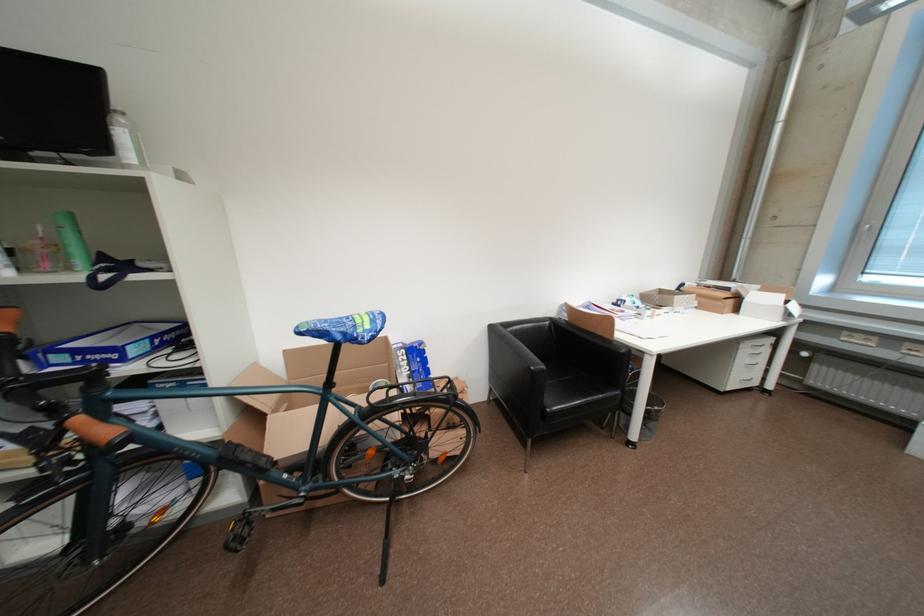
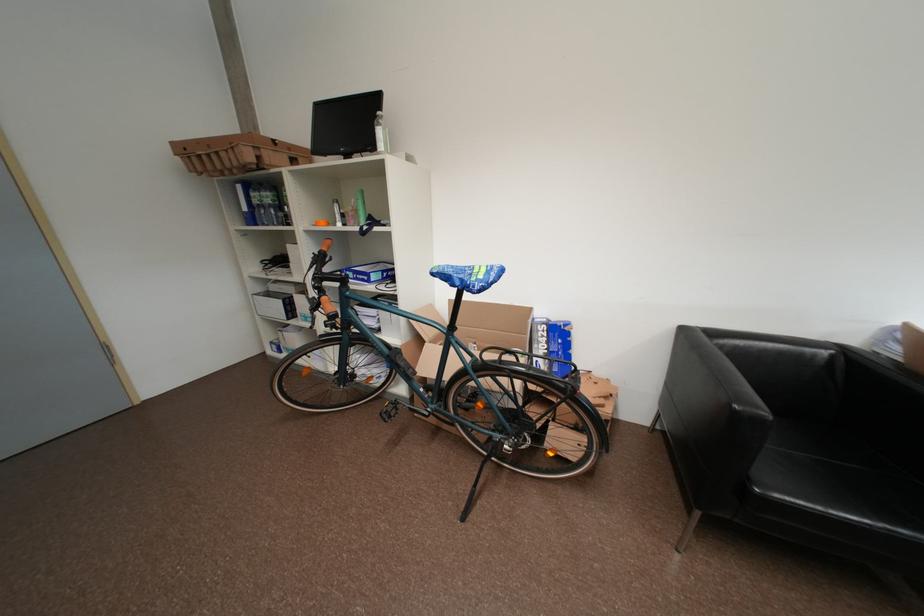
The point at (410, 353) is marked in the first image. Where is the corresponding point in the second image?

(553, 329)